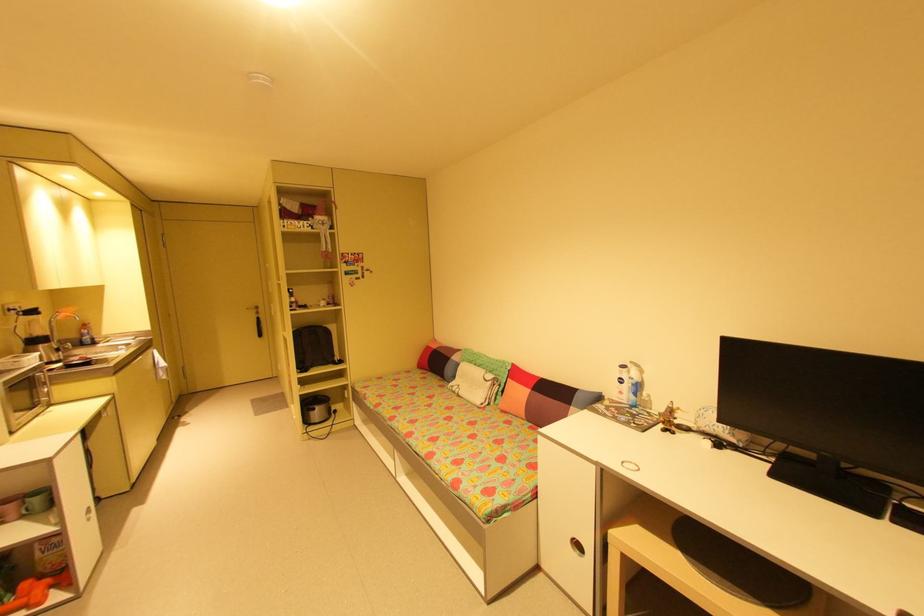
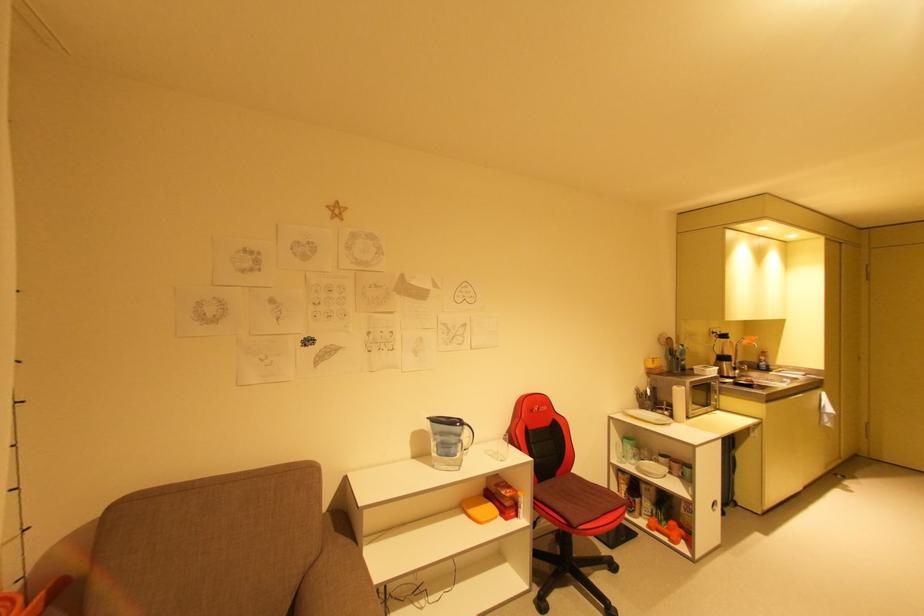
Where in the second image is the point corresponding to point (103, 345) from the first image?

(776, 373)